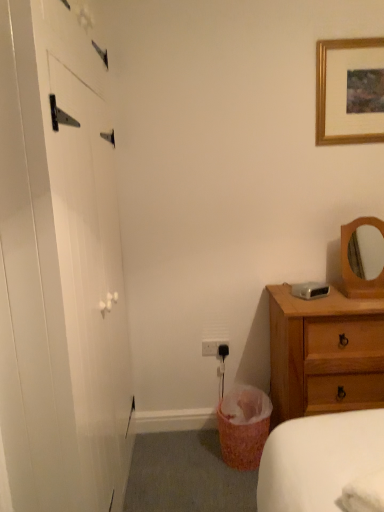
Question: Is the depth of gold wooden picture frame at upper right greater than that of white matte barn door at left?

Choices:
 (A) yes
 (B) no

Answer: (A)

Question: Does gold wooden picture frame at upper right appear on the right side of white matte barn door at left?

Choices:
 (A) no
 (B) yes

Answer: (B)

Question: Would you say gold wooden picture frame at upper right is a long distance from white matte barn door at left?

Choices:
 (A) no
 (B) yes

Answer: (B)

Question: Can we say gold wooden picture frame at upper right lies outside white matte barn door at left?

Choices:
 (A) yes
 (B) no

Answer: (A)

Question: Is white matte barn door at left inside gold wooden picture frame at upper right?

Choices:
 (A) no
 (B) yes

Answer: (A)

Question: Is white plastic electric outlet at lower center taller or shorter than pink woven laundry basket at lower center?

Choices:
 (A) short
 (B) tall

Answer: (A)

Question: Considering the positions of white plastic electric outlet at lower center and pink woven laundry basket at lower center in the image, is white plastic electric outlet at lower center wider or thinner than pink woven laundry basket at lower center?

Choices:
 (A) thin
 (B) wide

Answer: (A)

Question: Is white plastic electric outlet at lower center bigger or smaller than pink woven laundry basket at lower center?

Choices:
 (A) big
 (B) small

Answer: (B)

Question: Is point (208, 350) closer or farther from the camera than point (231, 444)?

Choices:
 (A) closer
 (B) farther

Answer: (B)

Question: Is white matte barn door at left taller or shorter than wooden chest of drawers at right?

Choices:
 (A) short
 (B) tall

Answer: (B)

Question: Is white matte barn door at left spatially inside wooden chest of drawers at right, or outside of it?

Choices:
 (A) outside
 (B) inside

Answer: (A)

Question: From the image's perspective, is white matte barn door at left above or below wooden chest of drawers at right?

Choices:
 (A) above
 (B) below

Answer: (A)

Question: Does point (1, 351) appear closer or farther from the camera than point (306, 393)?

Choices:
 (A) closer
 (B) farther

Answer: (A)

Question: Is point (379, 346) positioned closer to the camera than point (8, 134)?

Choices:
 (A) closer
 (B) farther

Answer: (B)

Question: Is wooden chest of drawers at right to the left or to the right of white matte barn door at left in the image?

Choices:
 (A) right
 (B) left

Answer: (A)